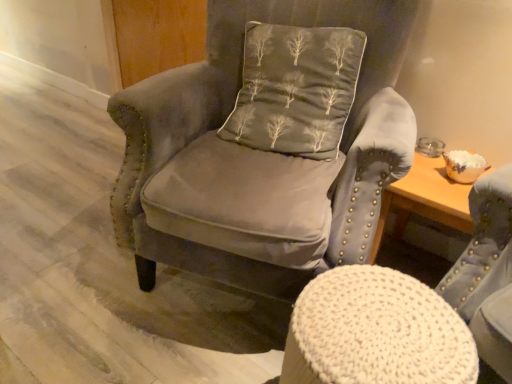
Question: Is velvet gray armchair at center, which is the first chair in top-to-bottom order, further to the viewer compared to knitted fabric stool at center, which ranks as the 2th chair in top-to-bottom order?

Choices:
 (A) yes
 (B) no

Answer: (A)

Question: Is velvet gray armchair at center, marked as the second chair in a bottom-to-top arrangement, at the right side of knitted fabric stool at center, which ranks as the 2th chair in top-to-bottom order?

Choices:
 (A) no
 (B) yes

Answer: (A)

Question: From a real-world perspective, is velvet gray armchair at center, which is the first chair in top-to-bottom order, located beneath knitted fabric stool at center, which ranks as the 2th chair in top-to-bottom order?

Choices:
 (A) no
 (B) yes

Answer: (A)

Question: From the image's perspective, is velvet gray armchair at center, which is the first chair in top-to-bottom order, located beneath knitted fabric stool at center, which ranks as the 2th chair in top-to-bottom order?

Choices:
 (A) yes
 (B) no

Answer: (B)

Question: Considering the relative sizes of velvet gray armchair at center, marked as the second chair in a bottom-to-top arrangement, and knitted fabric stool at center, which ranks as the 2th chair in top-to-bottom order, in the image provided, is velvet gray armchair at center, marked as the second chair in a bottom-to-top arrangement, smaller than knitted fabric stool at center, which ranks as the 2th chair in top-to-bottom order,?

Choices:
 (A) yes
 (B) no

Answer: (B)

Question: Looking at the image, does velvet gray armchair at center, which is the first chair in top-to-bottom order, seem bigger or smaller compared to knitted fabric stool at center, which ranks as the 2th chair in top-to-bottom order?

Choices:
 (A) small
 (B) big

Answer: (B)

Question: From a real-world perspective, is velvet gray armchair at center, which is the first chair in top-to-bottom order, positioned above or below knitted fabric stool at center, which is the 1th chair from bottom to top?

Choices:
 (A) below
 (B) above

Answer: (B)

Question: Is point (354, 44) closer or farther from the camera than point (462, 266)?

Choices:
 (A) farther
 (B) closer

Answer: (A)

Question: In terms of height, does velvet gray armchair at center, which is the first chair in top-to-bottom order, look taller or shorter compared to knitted fabric stool at center, which ranks as the 2th chair in top-to-bottom order?

Choices:
 (A) short
 (B) tall

Answer: (B)

Question: Do you think knitted fabric stool at center, which is the 1th chair from bottom to top, is within dark gray fabric pillow with tree pattern at center, or outside of it?

Choices:
 (A) inside
 (B) outside

Answer: (B)

Question: From the image's perspective, is knitted fabric stool at center, which ranks as the 2th chair in top-to-bottom order, positioned above or below dark gray fabric pillow with tree pattern at center?

Choices:
 (A) below
 (B) above

Answer: (A)

Question: Is point (482, 294) positioned closer to the camera than point (336, 28)?

Choices:
 (A) farther
 (B) closer

Answer: (B)

Question: Considering the positions of knitted fabric stool at center, which ranks as the 2th chair in top-to-bottom order, and dark gray fabric pillow with tree pattern at center in the image, is knitted fabric stool at center, which ranks as the 2th chair in top-to-bottom order, wider or thinner than dark gray fabric pillow with tree pattern at center?

Choices:
 (A) thin
 (B) wide

Answer: (B)

Question: Relative to velvet gray armchair at center, which is the first chair in top-to-bottom order, is dark gray fabric pillow with tree pattern at center in front or behind?

Choices:
 (A) behind
 (B) front

Answer: (A)

Question: Considering the positions of dark gray fabric pillow with tree pattern at center and velvet gray armchair at center, marked as the second chair in a bottom-to-top arrangement, in the image, is dark gray fabric pillow with tree pattern at center bigger or smaller than velvet gray armchair at center, marked as the second chair in a bottom-to-top arrangement,?

Choices:
 (A) big
 (B) small

Answer: (B)